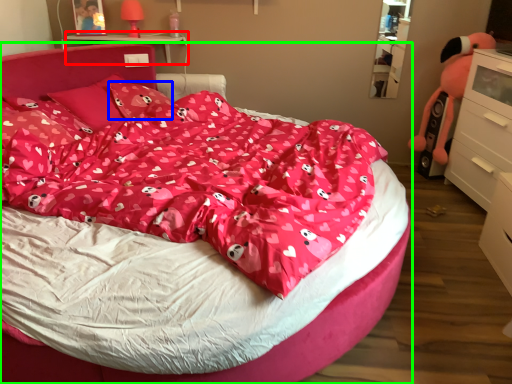
Question: Which object is positioned farthest from table (highlighted by a red box)? Select from pillow (highlighted by a blue box) and bed (highlighted by a green box).

Choices:
 (A) pillow
 (B) bed

Answer: (B)